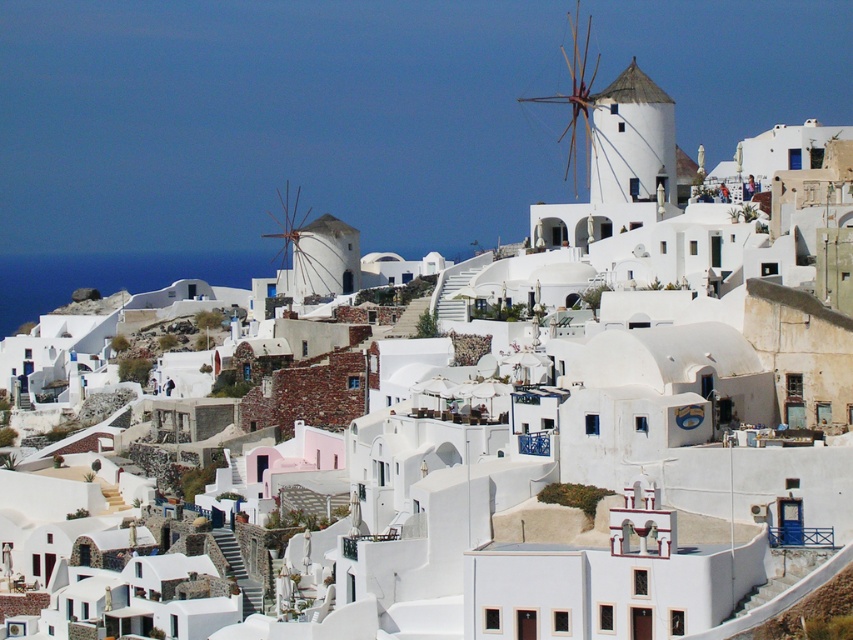
You are a tourist standing in the coastal village and want to take a photo of both the white matte windmill at center and the white wooden windmill at upper center. Which one should you point your camera at first to ensure both are in the frame?

You should point your camera at the white wooden windmill at upper center first because the white matte windmill at center is below it, so by focusing on the upper one, you can include both in your photo.

You are a drone operator tasked with capturing aerial footage of the coastal village. The white matte windmill at center is your primary focus. To ensure the windmill remains centered in the frame, where should you position your drone relative to the windmill?

The white matte windmill at center is located at the coordinates (317, 252). To keep it centered in the frame, position the drone directly above this point.

You are an architect designing a new coastal village and want to incorporate windmills similar to the ones in the image. Which of the two windmills, the white matte windmill at center or the white wooden windmill at upper center, would require more space to construct?

The white wooden windmill at upper center requires more space to construct because it occupies more space than the white matte windmill at center.